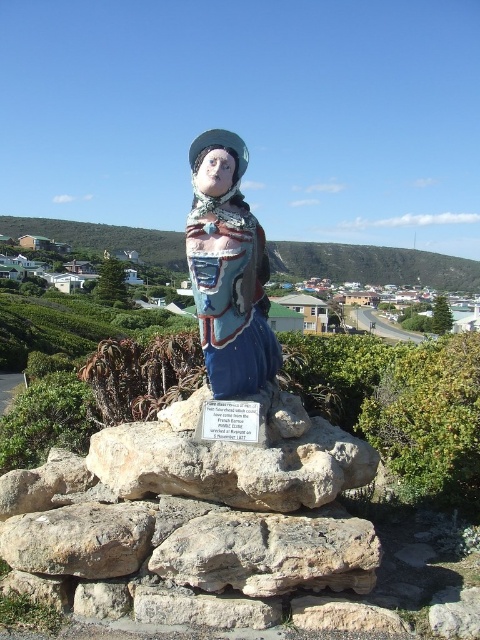
Between brown rough rock at lower center and green grassy hillside at upper center, which one has more height?

Standing taller between the two is green grassy hillside at upper center.

The image size is (480, 640). What do you see at coordinates (269, 552) in the screenshot? I see `brown rough rock at lower center` at bounding box center [269, 552].

What are the coordinates of `brown rough rock at lower center` in the screenshot? It's located at (269, 552).

Does painted ceramic statue at center have a greater height compared to brown rough rock at lower left?

Yes, painted ceramic statue at center is taller than brown rough rock at lower left.

Does painted ceramic statue at center come in front of brown rough rock at lower left?

No.

Where is `painted ceramic statue at center`? painted ceramic statue at center is located at coordinates (228, 269).

I want to click on painted ceramic statue at center, so click(228, 269).

Which of these two, gray rock at center or gray rough stone at lower center, stands taller?

With more height is gray rock at center.

Describe the element at coordinates (233, 458) in the screenshot. I see `gray rock at center` at that location.

Identify the location of gray rock at center. The height and width of the screenshot is (640, 480). (233, 458).